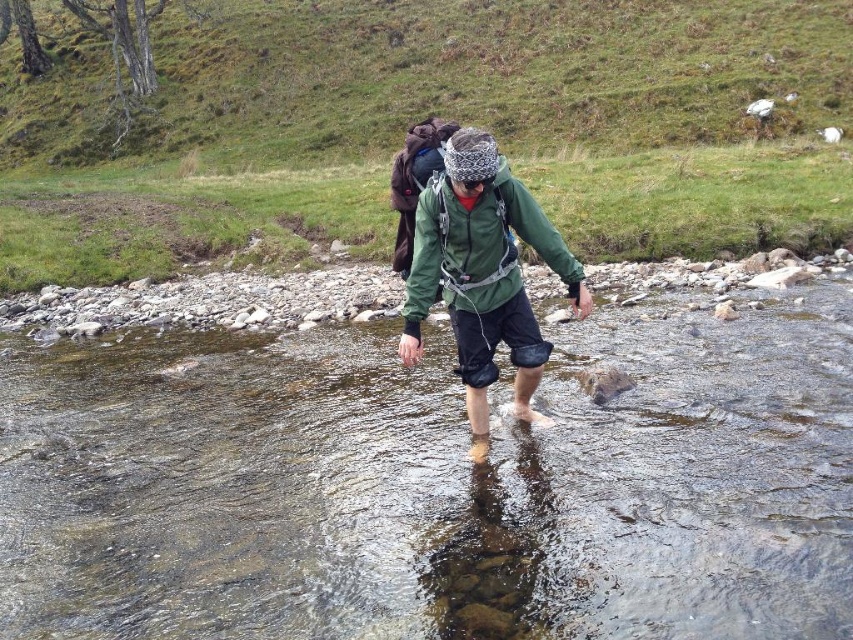
Does clear water at center have a larger size compared to green grass at upper center?

No.

Is point (80, 504) closer to camera compared to point (486, 108)?

Yes, point (80, 504) is closer to viewer.

Where is `clear water at center`? This screenshot has height=640, width=853. clear water at center is located at coordinates (433, 484).

Who is positioned more to the right, green grass at upper center or green matte jacket at center?

green matte jacket at center is more to the right.

Is point (491, 131) closer to viewer compared to point (544, 248)?

That is False.

At what (x,y) coordinates should I click in order to perform the action: click on green grass at upper center. Please return your answer as a coordinate pair (x, y). Looking at the image, I should click on (421, 118).

Is clear water at center shorter than green matte jacket at center?

Yes, clear water at center is shorter than green matte jacket at center.

Image resolution: width=853 pixels, height=640 pixels. Describe the element at coordinates (433, 484) in the screenshot. I see `clear water at center` at that location.

In order to click on clear water at center in this screenshot , I will do click(433, 484).